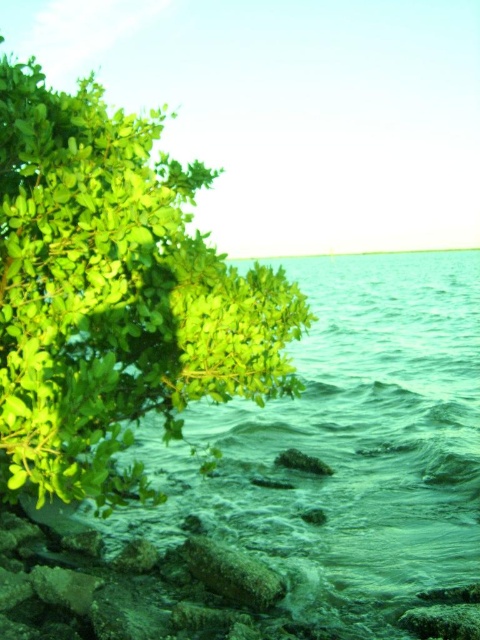
Does green leafy tree at left appear on the left side of green translucent water at lower left?

Yes, green leafy tree at left is to the left of green translucent water at lower left.

You are a GUI agent. You are given a task and a screenshot of the screen. Output one action in this format:
    pyautogui.click(x=<x>, y=<y>)
    Task: Click on the green leafy tree at left
    The image size is (480, 640).
    Given the screenshot: What is the action you would take?
    pyautogui.click(x=113, y=294)